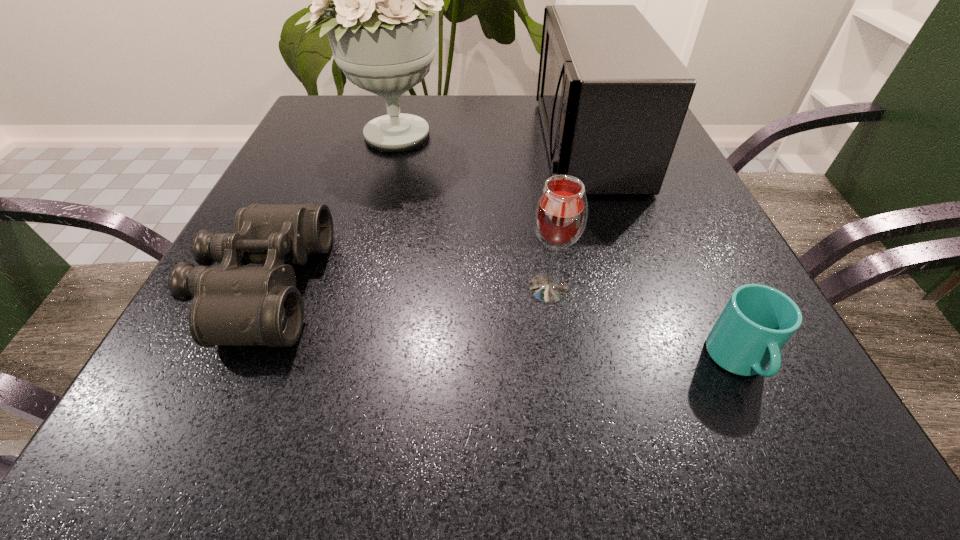
Image resolution: width=960 pixels, height=540 pixels. I want to click on free space located at the eyepieces of the binoculars, so click(480, 287).

Identify the location of free point located 0.050m on the handle side of the cup. This screenshot has height=540, width=960. (774, 435).

The height and width of the screenshot is (540, 960). What are the coordinates of `bouquet positioned at the far edge` in the screenshot? It's located at (381, 26).

Find the location of a particular element. This screenshot has height=540, width=960. microwave_oven located at the far edge is located at coordinates (612, 95).

Where is `object that is at the near edge`? Image resolution: width=960 pixels, height=540 pixels. object that is at the near edge is located at coordinates (757, 321).

Where is `bouquet that is at the left edge`? bouquet that is at the left edge is located at coordinates click(381, 26).

Where is `binoculars located at the left edge`? The width and height of the screenshot is (960, 540). binoculars located at the left edge is located at coordinates (233, 305).

The width and height of the screenshot is (960, 540). I want to click on microwave_oven situated at the right edge, so click(612, 95).

Image resolution: width=960 pixels, height=540 pixels. I want to click on cup that is positioned at the right edge, so tap(757, 321).

The image size is (960, 540). What are the coordinates of `object that is at the far left corner` in the screenshot? It's located at (381, 26).